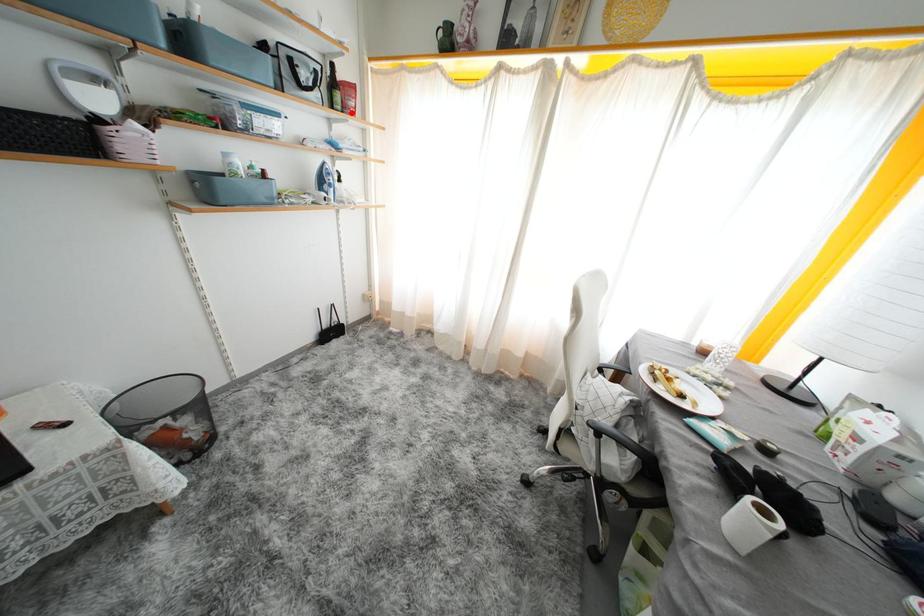
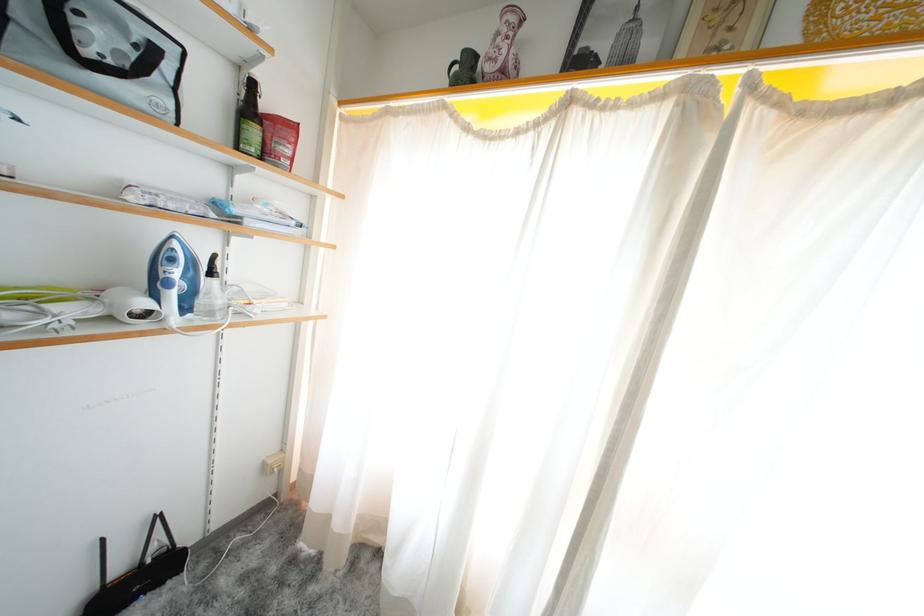
In the second image, find the point that corresponds to the highlighted location in the first image.

(273, 158)